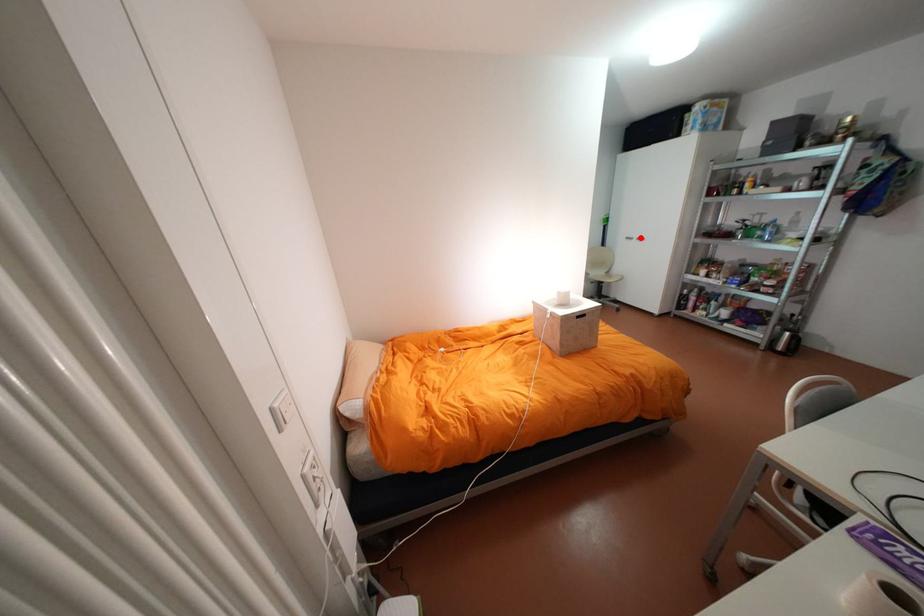
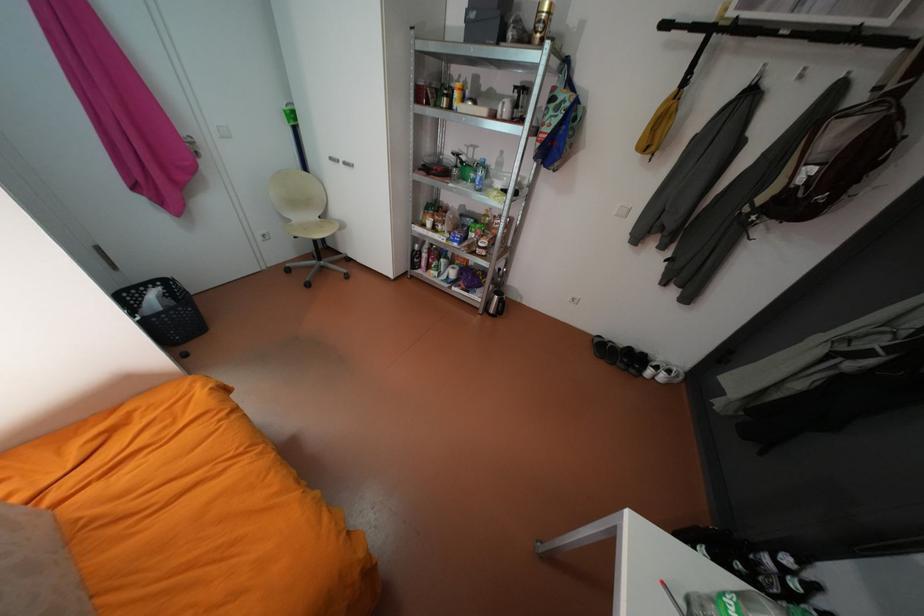
Locate, in the second image, the point that corresponds to the highlighted location in the first image.

(347, 160)